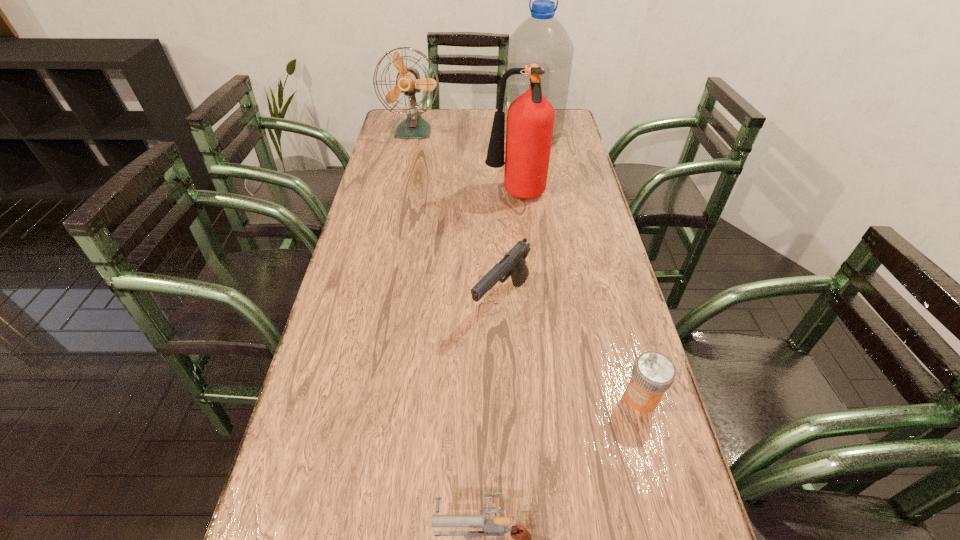
In order to click on water jug that is at the right edge in this screenshot , I will do `click(541, 39)`.

Image resolution: width=960 pixels, height=540 pixels. In order to click on fire extinguisher that is at the right edge in this screenshot , I will do `click(530, 119)`.

Locate an element on the screen. medicine that is at the right edge is located at coordinates (653, 373).

This screenshot has height=540, width=960. I want to click on object situated at the far left corner, so click(x=408, y=81).

Locate an element on the screen. The width and height of the screenshot is (960, 540). object that is at the far right corner is located at coordinates click(541, 39).

This screenshot has height=540, width=960. In the image, there is a desktop. Identify the location of vacant space at the far edge. (479, 130).

Identify the location of vacant area at the left edge. click(x=359, y=389).

Where is `vacant region at the right edge`? The image size is (960, 540). vacant region at the right edge is located at coordinates (594, 325).

Locate an element on the screen. Image resolution: width=960 pixels, height=540 pixels. vacant space in between the water jug and the fourth tallest object is located at coordinates (516, 220).

At what (x,y) coordinates should I click in order to perform the action: click on vacant space that is in between the fifth farthest object and the fourth shortest object. Please return your answer as a coordinate pair (x, y). The image size is (960, 540). Looking at the image, I should click on (527, 264).